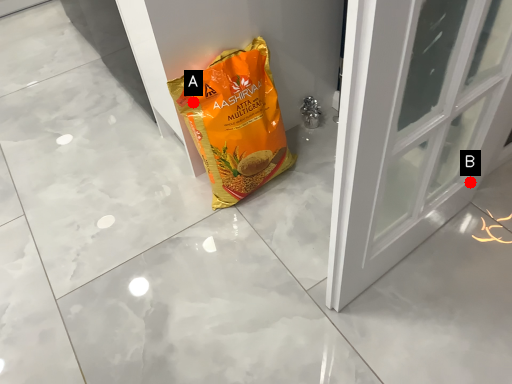
Question: Two points are circled on the image, labeled by A and B beside each circle. Which point appears farthest from the camera in this image?

Choices:
 (A) A is further
 (B) B is further

Answer: (B)